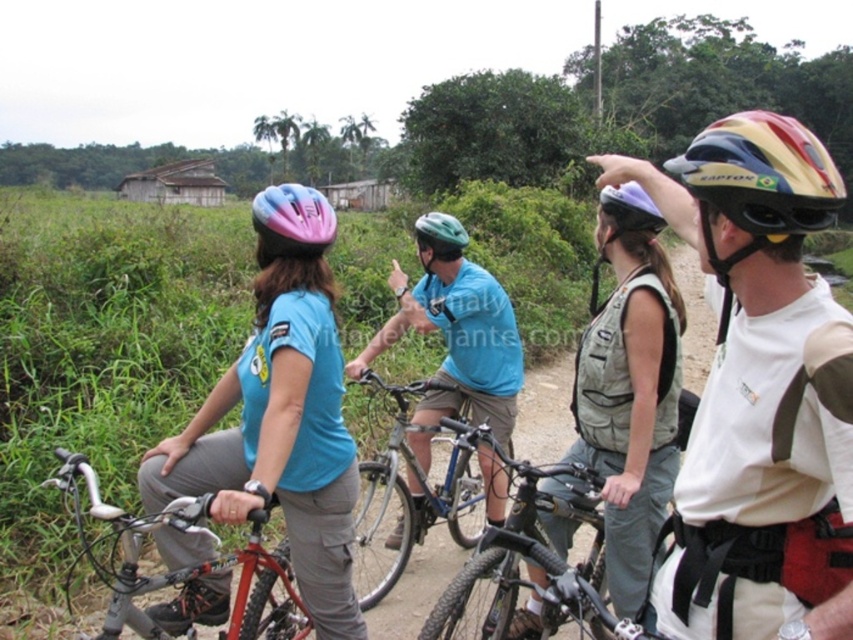
Is point (279, 284) more distant than point (317, 196)?

No, (279, 284) is in front of (317, 196).

This screenshot has height=640, width=853. I want to click on matte blue helmet at center, so click(280, 413).

Does matte blue helmet at center have a lesser width compared to red matte bicycle at left?

Yes, matte blue helmet at center is thinner than red matte bicycle at left.

Is point (140, 472) closer to viewer compared to point (247, 611)?

No, it is not.

This screenshot has height=640, width=853. Identify the location of matte blue helmet at center. (280, 413).

Does matte black helmet at center appear over matte blue helmet at center?

Indeed, matte black helmet at center is positioned over matte blue helmet at center.

Can you confirm if matte black helmet at center is taller than matte blue helmet at center?

In fact, matte black helmet at center may be shorter than matte blue helmet at center.

I want to click on matte black helmet at center, so pyautogui.click(x=759, y=392).